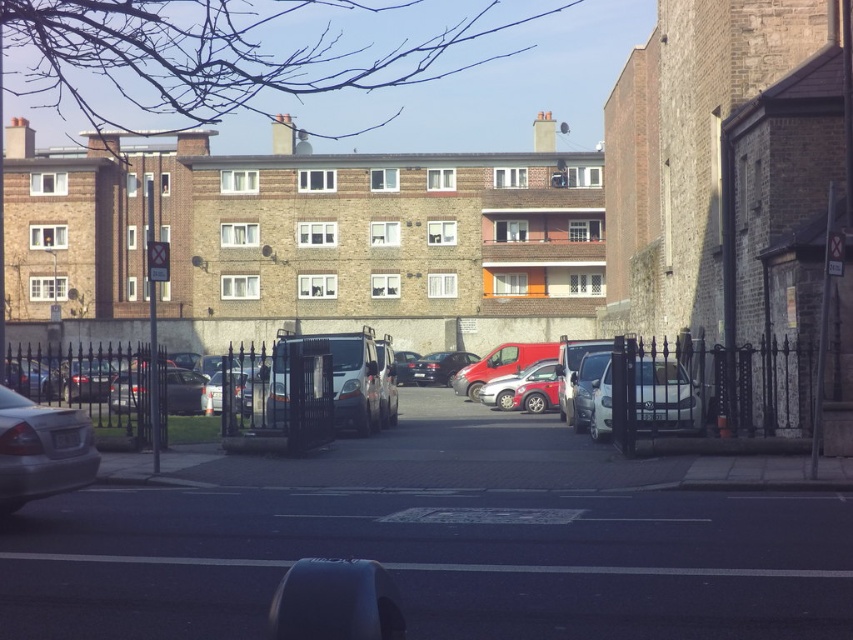
Is point (57, 480) farther from viewer compared to point (456, 362)?

No, (57, 480) is closer to viewer.

The width and height of the screenshot is (853, 640). Describe the element at coordinates (41, 451) in the screenshot. I see `silver metallic sedan at lower left` at that location.

This screenshot has width=853, height=640. I want to click on silver metallic sedan at lower left, so click(41, 451).

Does metallic gray parking meter at lower center have a greater width compared to white matte van at center?

Yes, metallic gray parking meter at lower center is wider than white matte van at center.

Does point (611, 618) lie in front of point (642, 362)?

Yes, it is.

I want to click on metallic gray parking meter at lower center, so coord(436,563).

Does silver metallic sedan at lower left appear under white matte van at center?

Correct, silver metallic sedan at lower left is located below white matte van at center.

You are a GUI agent. You are given a task and a screenshot of the screen. Output one action in this format:
    pyautogui.click(x=<x>, y=<y>)
    Task: Click on the silver metallic sedan at lower left
    Image resolution: width=853 pixels, height=640 pixels.
    Given the screenshot: What is the action you would take?
    pyautogui.click(x=41, y=451)